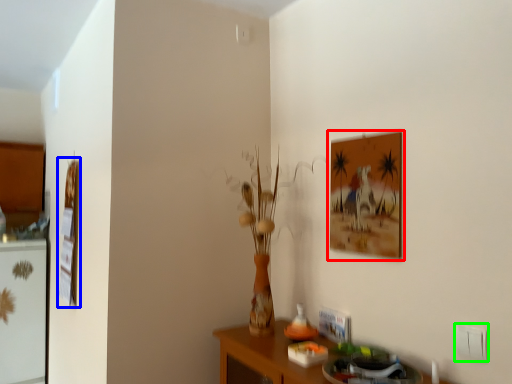
Question: Which is nearer to the picture frame (highlighted by a red box)? picture frame (highlighted by a blue box) or electric outlet (highlighted by a green box).

Choices:
 (A) picture frame
 (B) electric outlet

Answer: (B)